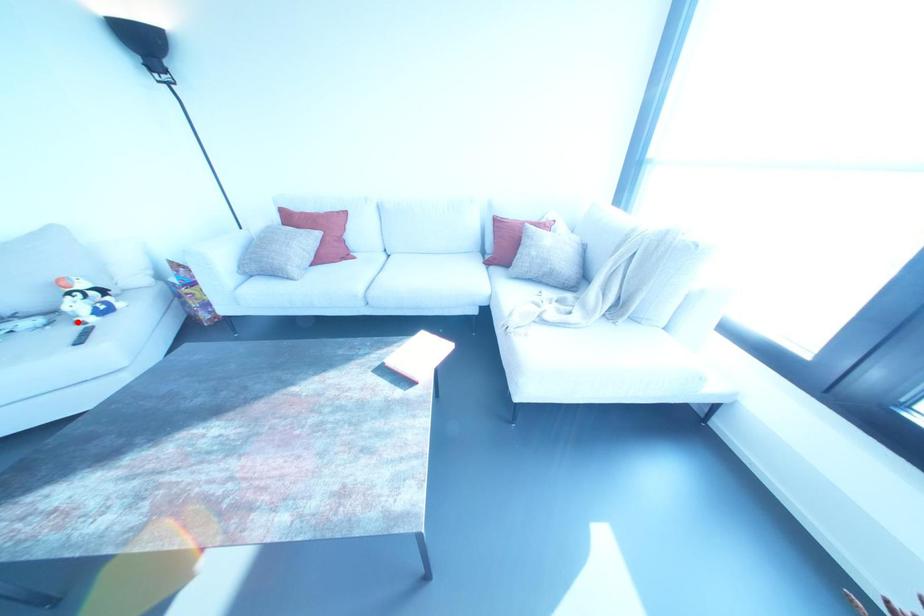
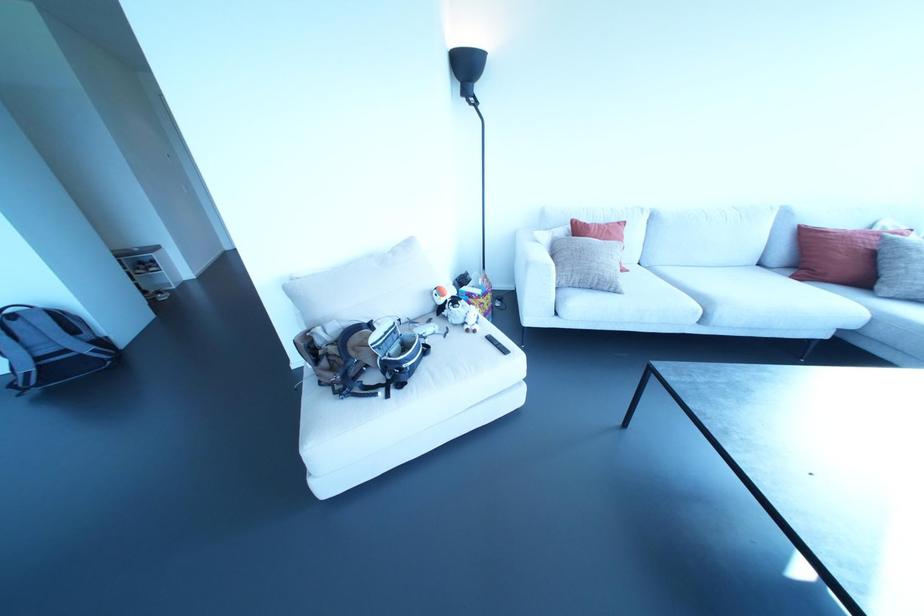
Locate, in the second image, the point that corresponds to the highlighted location in the first image.

(467, 330)